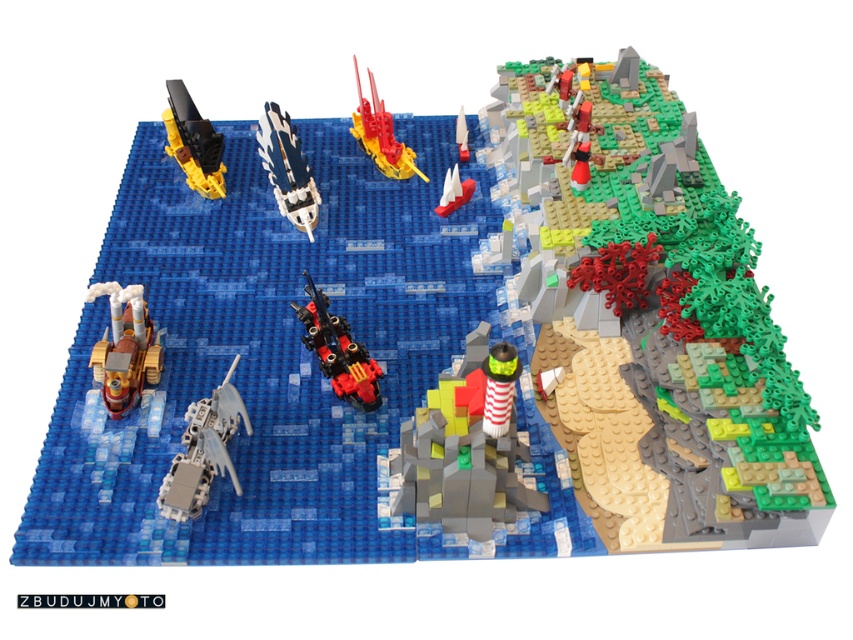
Does metallic silver spaceship at center-left appear on the right side of shiny metallic spaceship at center?

In fact, metallic silver spaceship at center-left is to the left of shiny metallic spaceship at center.

Is point (233, 400) positioned in front of point (280, 184)?

That is True.

Locate an element on the screen. The height and width of the screenshot is (640, 853). metallic silver spaceship at center-left is located at coordinates (202, 451).

What do you see at coordinates (338, 352) in the screenshot?
I see `shiny black and red plastic submarine at center` at bounding box center [338, 352].

This screenshot has width=853, height=640. Identify the location of shiny black and red plastic submarine at center. (338, 352).

Is red and white striped lighthouse at center above gold metallic steamboat at lower left?

Actually, red and white striped lighthouse at center is below gold metallic steamboat at lower left.

Is red and white striped lighthouse at center to the right of gold metallic steamboat at lower left from the viewer's perspective?

Correct, you'll find red and white striped lighthouse at center to the right of gold metallic steamboat at lower left.

Measure the distance between point (498, 532) and camera.

A distance of 3.56 feet exists between point (498, 532) and camera.

I want to click on red and white striped lighthouse at center, so click(466, 458).